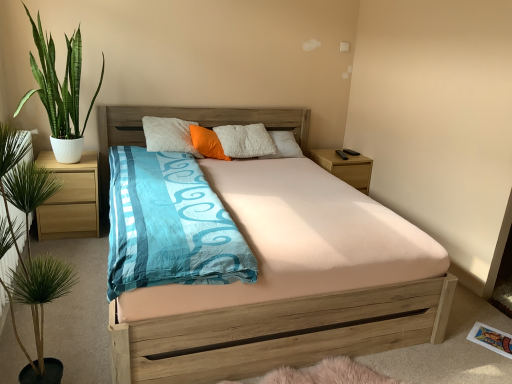
Image resolution: width=512 pixels, height=384 pixels. I want to click on wooden nightstand at right, which is the 1th nightstand in back-to-front order, so click(x=345, y=167).

What do you see at coordinates (207, 143) in the screenshot?
I see `orange soft pillow at center` at bounding box center [207, 143].

Measure the distance between point [29,281] and camera.

4.96 feet.

What do you see at coordinates (30, 250) in the screenshot? I see `green leafy plant at left, marked as the second houseplant in a back-to-front arrangement` at bounding box center [30, 250].

Where is `light brown wood at left, the first nightstand when ordered from front to back`? This screenshot has width=512, height=384. light brown wood at left, the first nightstand when ordered from front to back is located at coordinates (70, 199).

This screenshot has width=512, height=384. Find the location of `wooden nightstand at right, acting as the 1th nightstand starting from the right`. wooden nightstand at right, acting as the 1th nightstand starting from the right is located at coordinates (345, 167).

Which point is more forward, (x=218, y=328) or (x=364, y=183)?

The point (x=218, y=328) is more forward.

Considering the relative sizes of wooden bed at center and wooden nightstand at right, acting as the 1th nightstand starting from the right, in the image provided, is wooden bed at center shorter than wooden nightstand at right, acting as the 1th nightstand starting from the right,?

Incorrect, the height of wooden bed at center does not fall short of that of wooden nightstand at right, acting as the 1th nightstand starting from the right.

Based on their positions, is wooden bed at center located to the left or right of wooden nightstand at right, which is the 2th nightstand from left to right?

wooden bed at center is positioned on wooden nightstand at right, which is the 2th nightstand from left to right,'s left side.

Is wooden bed at center bigger than wooden nightstand at right, acting as the 1th nightstand starting from the right?

Yes.

Considering the relative positions of wooden bed at center and green leafy plant at left, marked as the second houseplant in a back-to-front arrangement, in the image provided, is wooden bed at center to the left or to the right of green leafy plant at left, marked as the second houseplant in a back-to-front arrangement,?

Based on their positions, wooden bed at center is located to the right of green leafy plant at left, marked as the second houseplant in a back-to-front arrangement.

Does wooden bed at center have a larger size compared to green leafy plant at left, which ranks as the 1th houseplant in bottom-to-top order?

Yes, wooden bed at center is bigger than green leafy plant at left, which ranks as the 1th houseplant in bottom-to-top order.

From a real-world perspective, between wooden bed at center and green leafy plant at left, which appears as the first houseplant when viewed from the front, who is vertically lower?

From a 3D spatial view, wooden bed at center is below.

At what (x,y) coordinates should I click in order to perform the action: click on houseplant on the left of green leafy plant at left, which ranks as the 1th houseplant in bottom-to-top order. Please return your answer as a coordinate pair (x, y). Image resolution: width=512 pixels, height=384 pixels. Looking at the image, I should click on (60, 91).

Could you tell me if green leafy plant at left, which appears as the first houseplant when viewed from the front, is turned towards green glossy plant at left, the second houseplant when ordered from bottom to top?

No, green leafy plant at left, which appears as the first houseplant when viewed from the front, is not oriented towards green glossy plant at left, the second houseplant when ordered from bottom to top.

Considering the relative positions of green leafy plant at left, which is the 2th houseplant in top-to-bottom order, and green glossy plant at left, marked as the 2th houseplant in a front-to-back arrangement, in the image provided, is green leafy plant at left, which is the 2th houseplant in top-to-bottom order, to the left of green glossy plant at left, marked as the 2th houseplant in a front-to-back arrangement, from the viewer's perspective?

Incorrect, green leafy plant at left, which is the 2th houseplant in top-to-bottom order, is not on the left side of green glossy plant at left, marked as the 2th houseplant in a front-to-back arrangement.

Does point (20, 133) come closer to viewer compared to point (99, 85)?

Yes, it is.

Does green leafy plant at left, which appears as the first houseplant when viewed from the front, have a smaller size compared to orange soft pillow at center?

Actually, green leafy plant at left, which appears as the first houseplant when viewed from the front, might be larger than orange soft pillow at center.

Which is behind, green leafy plant at left, marked as the second houseplant in a back-to-front arrangement, or orange soft pillow at center?

orange soft pillow at center is more distant.

From a real-world perspective, is green leafy plant at left, which appears as the first houseplant when viewed from the front, on orange soft pillow at center?

Incorrect, from a real-world perspective, green leafy plant at left, which appears as the first houseplant when viewed from the front, is lower than orange soft pillow at center.

Is orange soft pillow at center a part of green leafy plant at left, which is the 2th houseplant in top-to-bottom order?

No, orange soft pillow at center is not a part of green leafy plant at left, which is the 2th houseplant in top-to-bottom order.

Which is more to the right, light brown wood at left, the 2th nightstand viewed from the back, or green leafy plant at left, which ranks as the 1th houseplant in bottom-to-top order?

green leafy plant at left, which ranks as the 1th houseplant in bottom-to-top order, is more to the right.

Who is shorter, light brown wood at left, marked as the first nightstand in a left-to-right arrangement, or green leafy plant at left, which is the 2th houseplant in top-to-bottom order?

Standing shorter between the two is light brown wood at left, marked as the first nightstand in a left-to-right arrangement.

Between point (39, 208) and point (2, 183), which one is positioned in front?

The point (2, 183) is in front.

Are light brown wood at left, acting as the second nightstand starting from the right, and green leafy plant at left, which is the 2th houseplant in top-to-bottom order, located far from each other?

Yes, light brown wood at left, acting as the second nightstand starting from the right, and green leafy plant at left, which is the 2th houseplant in top-to-bottom order, are located far from each other.

From a real-world perspective, between orange soft pillow at center and wooden nightstand at right, acting as the 1th nightstand starting from the right, who is vertically higher?

From a 3D spatial view, orange soft pillow at center is above.

Measure the distance from orange soft pillow at center to wooden nightstand at right, which is the 1th nightstand in back-to-front order.

orange soft pillow at center is 1.04 meters away from wooden nightstand at right, which is the 1th nightstand in back-to-front order.

In terms of width, does orange soft pillow at center look wider or thinner when compared to wooden nightstand at right, which is the 1th nightstand in back-to-front order?

Considering their sizes, orange soft pillow at center looks slimmer than wooden nightstand at right, which is the 1th nightstand in back-to-front order.

Which object is further away from the camera taking this photo, orange soft pillow at center or wooden nightstand at right, acting as the 1th nightstand starting from the right?

wooden nightstand at right, acting as the 1th nightstand starting from the right, is behind.

Is wooden bed at center in front of or behind light brown wood at left, the 2th nightstand viewed from the back, in the image?

wooden bed at center is positioned closer to the viewer than light brown wood at left, the 2th nightstand viewed from the back.

From a real-world perspective, which object rests below the other?

light brown wood at left, the first nightstand when ordered from front to back.

Is wooden bed at center positioned with its back to light brown wood at left, marked as the first nightstand in a left-to-right arrangement?

That's not correct — wooden bed at center is not looking away from light brown wood at left, marked as the first nightstand in a left-to-right arrangement.

Is wooden bed at center touching light brown wood at left, the first nightstand when ordered from front to back?

No, wooden bed at center is not beside light brown wood at left, the first nightstand when ordered from front to back.

The image size is (512, 384). What are the coordinates of `bed below the wooden nightstand at right, which is the second nightstand from front to back (from the image's perspective)` in the screenshot? It's located at (278, 332).

The width and height of the screenshot is (512, 384). In order to click on bed that appears below the green leafy plant at left, marked as the second houseplant in a back-to-front arrangement (from a real-world perspective) in this screenshot , I will do `click(278, 332)`.

Looking at the image, which one is located closer to light brown wood at left, acting as the second nightstand starting from the right, wooden bed at center or orange soft pillow at center?

The object closer to light brown wood at left, acting as the second nightstand starting from the right, is orange soft pillow at center.

Considering their positions, is green glossy plant at left, which is the 1th houseplant in top-to-bottom order, positioned closer to green leafy plant at left, marked as the second houseplant in a back-to-front arrangement, than orange soft pillow at center?

green glossy plant at left, which is the 1th houseplant in top-to-bottom order, lies closer to green leafy plant at left, marked as the second houseplant in a back-to-front arrangement, than the other object.

Estimate the real-world distances between objects in this image. Which object is further from wooden bed at center, light brown wood at left, marked as the first nightstand in a left-to-right arrangement, or green glossy plant at left, the second houseplant when ordered from bottom to top?

Based on the image, green glossy plant at left, the second houseplant when ordered from bottom to top, appears to be further to wooden bed at center.

Estimate the real-world distances between objects in this image. Which object is further from wooden bed at center, green glossy plant at left, which is the 1th houseplant in top-to-bottom order, or light brown wood at left, marked as the first nightstand in a left-to-right arrangement?

green glossy plant at left, which is the 1th houseplant in top-to-bottom order, lies further to wooden bed at center than the other object.

When comparing their distances from green glossy plant at left, placed as the 1th houseplant when sorted from back to front, does green leafy plant at left, which is the 2th houseplant in top-to-bottom order, or wooden nightstand at right, which is the 2th nightstand from left to right, seem further?

Among the two, wooden nightstand at right, which is the 2th nightstand from left to right, is located further to green glossy plant at left, placed as the 1th houseplant when sorted from back to front.

Considering their positions, is wooden nightstand at right, which is the 2th nightstand from left to right, positioned closer to light brown wood at left, the first nightstand when ordered from front to back, than green leafy plant at left, marked as the second houseplant in a back-to-front arrangement?

green leafy plant at left, marked as the second houseplant in a back-to-front arrangement, lies closer to light brown wood at left, the first nightstand when ordered from front to back, than the other object.

Considering their positions, is orange soft pillow at center positioned closer to light brown wood at left, the first nightstand when ordered from front to back, than wooden bed at center?

orange soft pillow at center lies closer to light brown wood at left, the first nightstand when ordered from front to back, than the other object.

Estimate the real-world distances between objects in this image. Which object is closer to green leafy plant at left, which is the 2th houseplant in top-to-bottom order, wooden bed at center or wooden nightstand at right, which is the second nightstand from front to back?

Based on the image, wooden bed at center appears to be nearer to green leafy plant at left, which is the 2th houseplant in top-to-bottom order.

Locate an element on the screen. Image resolution: width=512 pixels, height=384 pixels. houseplant between green leafy plant at left, marked as the second houseplant in a back-to-front arrangement, and wooden nightstand at right, which is the second nightstand from front to back, along the z-axis is located at coordinates (60, 91).

The width and height of the screenshot is (512, 384). Find the location of `nightstand between green leafy plant at left, marked as the second houseplant in a back-to-front arrangement, and wooden nightstand at right, which is the 2th nightstand from left to right, along the z-axis`. nightstand between green leafy plant at left, marked as the second houseplant in a back-to-front arrangement, and wooden nightstand at right, which is the 2th nightstand from left to right, along the z-axis is located at coordinates (70, 199).

Where is `pillow located between wooden bed at center and wooden nightstand at right, which is the 1th nightstand in back-to-front order, in the depth direction`? This screenshot has height=384, width=512. pillow located between wooden bed at center and wooden nightstand at right, which is the 1th nightstand in back-to-front order, in the depth direction is located at coordinates (207, 143).

Image resolution: width=512 pixels, height=384 pixels. I want to click on bed positioned between green leafy plant at left, marked as the second houseplant in a back-to-front arrangement, and wooden nightstand at right, which is the 2th nightstand from left to right, from near to far, so click(x=278, y=332).